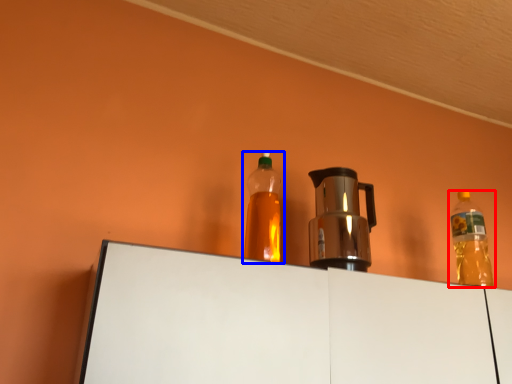
Question: Among these objects, which one is nearest to the camera, bottle (highlighted by a red box) or bottle (highlighted by a blue box)?

Choices:
 (A) bottle
 (B) bottle

Answer: (B)